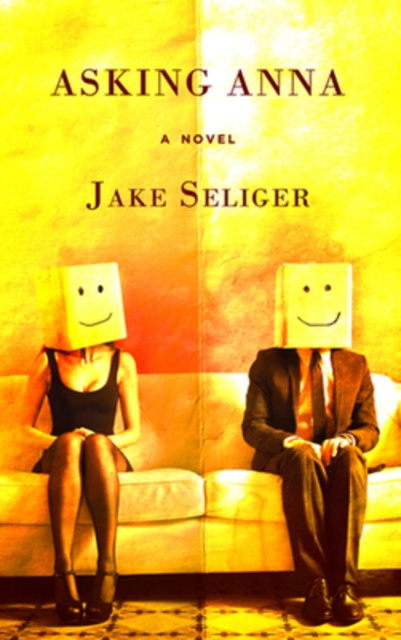
Question: In this image, where is matte brown suit at center located relative to yellow matte square at center?

Choices:
 (A) below
 (B) above

Answer: (A)

Question: Which point is closer to the camera?

Choices:
 (A) matte black dress at left
 (B) beige fabric couch at center
 (C) yellow matte square at center

Answer: (A)

Question: Does matte black dress at left appear on the right side of yellow matte square at center?

Choices:
 (A) yes
 (B) no

Answer: (B)

Question: Among these objects, which one is nearest to the camera?

Choices:
 (A) matte black dress at left
 (B) matte brown suit at center
 (C) beige fabric couch at center
 (D) yellow matte square at center

Answer: (A)

Question: Among these objects, which one is nearest to the camera?

Choices:
 (A) matte black dress at left
 (B) matte brown suit at center

Answer: (A)

Question: Can you confirm if beige fabric couch at center is positioned above yellow matte square at center?

Choices:
 (A) yes
 (B) no

Answer: (B)